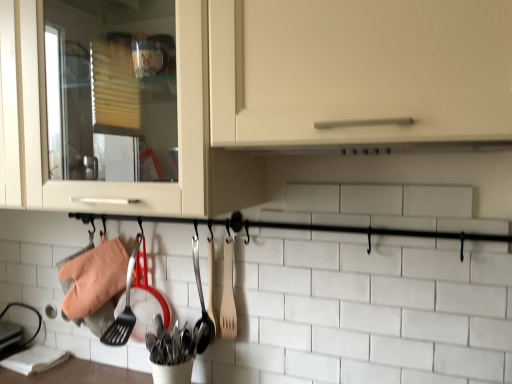
Question: Is polished stainless steel utensils at center, arranged as the first silverware when viewed from the left, positioned with its back to wooden spatula at center?

Choices:
 (A) yes
 (B) no

Answer: (B)

Question: Considering the relative sizes of polished stainless steel utensils at center, which ranks as the 2th silverware in right-to-left order, and wooden spatula at center in the image provided, is polished stainless steel utensils at center, which ranks as the 2th silverware in right-to-left order, smaller than wooden spatula at center?

Choices:
 (A) no
 (B) yes

Answer: (A)

Question: Considering the relative sizes of polished stainless steel utensils at center, which ranks as the 2th silverware in right-to-left order, and wooden spatula at center in the image provided, is polished stainless steel utensils at center, which ranks as the 2th silverware in right-to-left order, wider than wooden spatula at center?

Choices:
 (A) no
 (B) yes

Answer: (B)

Question: Is there a large distance between polished stainless steel utensils at center, arranged as the first silverware when viewed from the left, and wooden spatula at center?

Choices:
 (A) yes
 (B) no

Answer: (B)

Question: Is polished stainless steel utensils at center, which ranks as the 2th silverware in right-to-left order, shorter than wooden spatula at center?

Choices:
 (A) yes
 (B) no

Answer: (A)

Question: Would you say polished stainless steel utensils at center, which ranks as the 2th silverware in right-to-left order, is inside or outside wooden spoon at center, arranged as the 2th silverware when viewed from the left?

Choices:
 (A) inside
 (B) outside

Answer: (B)

Question: Relative to wooden spoon at center, which ranks as the first silverware in right-to-left order, is polished stainless steel utensils at center, arranged as the first silverware when viewed from the left, in front or behind?

Choices:
 (A) behind
 (B) front

Answer: (B)

Question: From the image's perspective, is polished stainless steel utensils at center, arranged as the first silverware when viewed from the left, positioned above or below wooden spoon at center, which ranks as the first silverware in right-to-left order?

Choices:
 (A) above
 (B) below

Answer: (B)

Question: In terms of size, does polished stainless steel utensils at center, which ranks as the 2th silverware in right-to-left order, appear bigger or smaller than wooden spoon at center, which ranks as the first silverware in right-to-left order?

Choices:
 (A) big
 (B) small

Answer: (A)

Question: Is matte white cabinet at center in front of or behind polished stainless steel utensils at center, which ranks as the 2th silverware in right-to-left order, in the image?

Choices:
 (A) behind
 (B) front

Answer: (B)

Question: From a real-world perspective, is matte white cabinet at center above or below polished stainless steel utensils at center, arranged as the first silverware when viewed from the left?

Choices:
 (A) below
 (B) above

Answer: (B)

Question: Considering the positions of matte white cabinet at center and polished stainless steel utensils at center, arranged as the first silverware when viewed from the left, in the image, is matte white cabinet at center wider or thinner than polished stainless steel utensils at center, arranged as the first silverware when viewed from the left,?

Choices:
 (A) wide
 (B) thin

Answer: (A)

Question: Is point (140, 193) positioned closer to the camera than point (153, 334)?

Choices:
 (A) farther
 (B) closer

Answer: (B)

Question: From the image's perspective, relative to wooden spatula at center, is wooden spoon at center, which ranks as the first silverware in right-to-left order, above or below?

Choices:
 (A) below
 (B) above

Answer: (A)

Question: Is point (203, 314) positioned closer to the camera than point (228, 286)?

Choices:
 (A) closer
 (B) farther

Answer: (B)